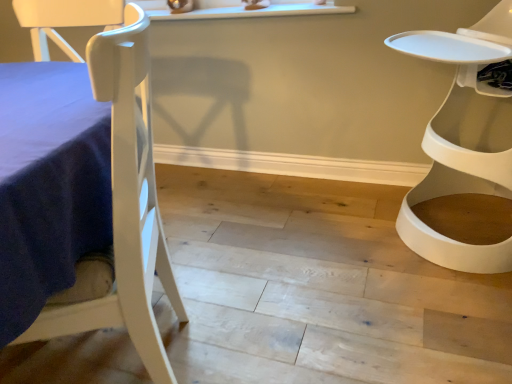
Question: Do you think white plastic chair at right, the second chair in the left-to-right sequence, is within white matte chair at left, marked as the 1th chair in a left-to-right arrangement, or outside of it?

Choices:
 (A) inside
 (B) outside

Answer: (B)

Question: In terms of height, does white plastic chair at right, which appears as the first chair when viewed from the right, look taller or shorter compared to white matte chair at left, which is counted as the 2th chair, starting from the right?

Choices:
 (A) tall
 (B) short

Answer: (B)

Question: Is point (481, 41) positioned closer to the camera than point (70, 306)?

Choices:
 (A) closer
 (B) farther

Answer: (B)

Question: Visually, is white matte chair at left, marked as the 1th chair in a left-to-right arrangement, positioned to the left or to the right of white plastic chair at right, which appears as the first chair when viewed from the right?

Choices:
 (A) left
 (B) right

Answer: (A)

Question: Choose the correct answer: Is white matte chair at left, marked as the 1th chair in a left-to-right arrangement, inside white plastic chair at right, the second chair in the left-to-right sequence, or outside it?

Choices:
 (A) outside
 (B) inside

Answer: (A)

Question: From the image's perspective, is white matte chair at left, which is counted as the 2th chair, starting from the right, located above or below white plastic chair at right, which appears as the first chair when viewed from the right?

Choices:
 (A) below
 (B) above

Answer: (A)

Question: Considering the positions of point (47, 334) and point (414, 196), is point (47, 334) closer or farther from the camera than point (414, 196)?

Choices:
 (A) closer
 (B) farther

Answer: (A)